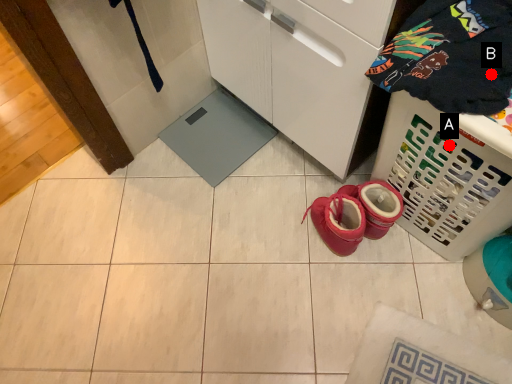
Question: Two points are circled on the image, labeled by A and B beside each circle. Which of the following is the closest to the observer?

Choices:
 (A) A is closer
 (B) B is closer

Answer: (B)